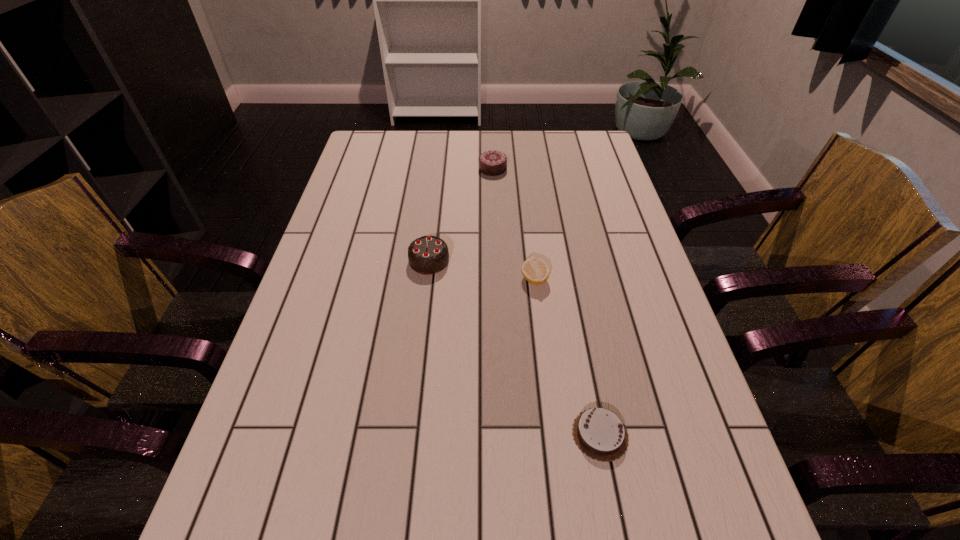
At what (x,y) coordinates should I click in order to perform the action: click on the second nearest chocolate cake. Please return your answer as a coordinate pair (x, y). The height and width of the screenshot is (540, 960). Looking at the image, I should click on 427,255.

Identify the location of the tallest object. The image size is (960, 540). (427, 255).

The height and width of the screenshot is (540, 960). What are the coordinates of `the second tallest object` in the screenshot? It's located at (492, 163).

At what (x,y) coordinates should I click in order to perform the action: click on the farthest object. Please return your answer as a coordinate pair (x, y). The height and width of the screenshot is (540, 960). Looking at the image, I should click on (492, 163).

This screenshot has width=960, height=540. I want to click on lemon, so click(535, 270).

I want to click on the third tallest object, so click(535, 270).

This screenshot has height=540, width=960. Identify the location of the shortest chocolate cake. (599, 433).

Where is `the nearest chocolate cake`? The image size is (960, 540). the nearest chocolate cake is located at coordinates (599, 433).

You are a GUI agent. You are given a task and a screenshot of the screen. Output one action in this format:
    pyautogui.click(x=<x>, y=<y>)
    Task: Click on the vacant space situated 0.200m on the right of the tallest object
    
    Given the screenshot: What is the action you would take?
    pyautogui.click(x=525, y=261)

Where is `vacant space positioned on the front of the farthest chocolate cake`? The width and height of the screenshot is (960, 540). vacant space positioned on the front of the farthest chocolate cake is located at coordinates (494, 205).